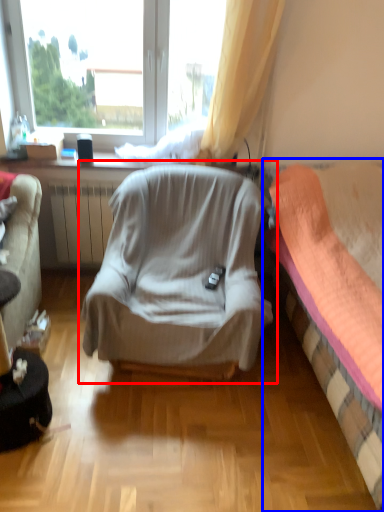
Question: Among these objects, which one is farthest to the camera, chair (highlighted by a red box) or bed (highlighted by a blue box)?

Choices:
 (A) chair
 (B) bed

Answer: (A)